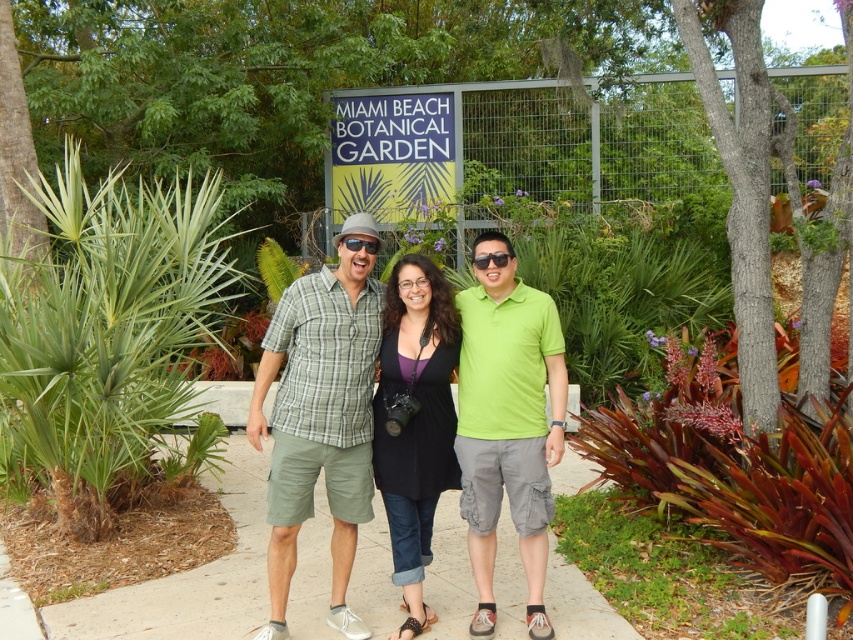
Between green leafy plant at left and plaid cotton shirt at center, which one appears on the left side from the viewer's perspective?

green leafy plant at left

Can you confirm if green leafy plant at left is smaller than plaid cotton shirt at center?

No, green leafy plant at left is not smaller than plaid cotton shirt at center.

Image resolution: width=853 pixels, height=640 pixels. Describe the element at coordinates (113, 342) in the screenshot. I see `green leafy plant at left` at that location.

The width and height of the screenshot is (853, 640). In order to click on green leafy plant at left in this screenshot , I will do `click(113, 342)`.

Can you confirm if plaid cotton shirt at center is wider than black matte dress at center?

Correct, the width of plaid cotton shirt at center exceeds that of black matte dress at center.

Can you confirm if plaid cotton shirt at center is positioned above black matte dress at center?

Correct, plaid cotton shirt at center is located above black matte dress at center.

Who is more distant from viewer, (279, 460) or (415, 308)?

Positioned behind is point (415, 308).

The width and height of the screenshot is (853, 640). What are the coordinates of `plaid cotton shirt at center` in the screenshot? It's located at (347, 413).

Based on the photo, does lime green polo shirt at center appear under black matte dress at center?

Incorrect, lime green polo shirt at center is not positioned below black matte dress at center.

Between lime green polo shirt at center and black matte dress at center, which one is positioned higher?

lime green polo shirt at center

Describe the element at coordinates (508, 429) in the screenshot. Image resolution: width=853 pixels, height=640 pixels. I see `lime green polo shirt at center` at that location.

You are a GUI agent. You are given a task and a screenshot of the screen. Output one action in this format:
    pyautogui.click(x=<x>, y=<y>)
    Task: Click on the lime green polo shirt at center
    This screenshot has width=853, height=640.
    Given the screenshot: What is the action you would take?
    pyautogui.click(x=508, y=429)